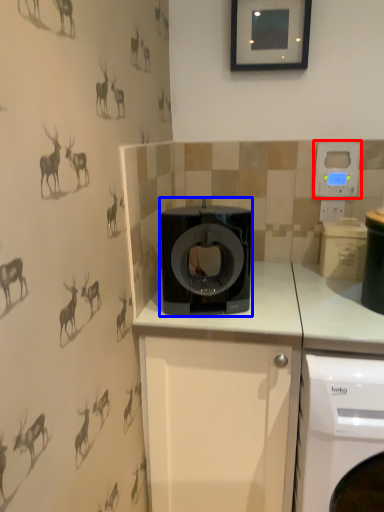
Question: Which object is closer to the camera taking this photo, thermostat (highlighted by a red box) or home appliance (highlighted by a blue box)?

Choices:
 (A) thermostat
 (B) home appliance

Answer: (B)